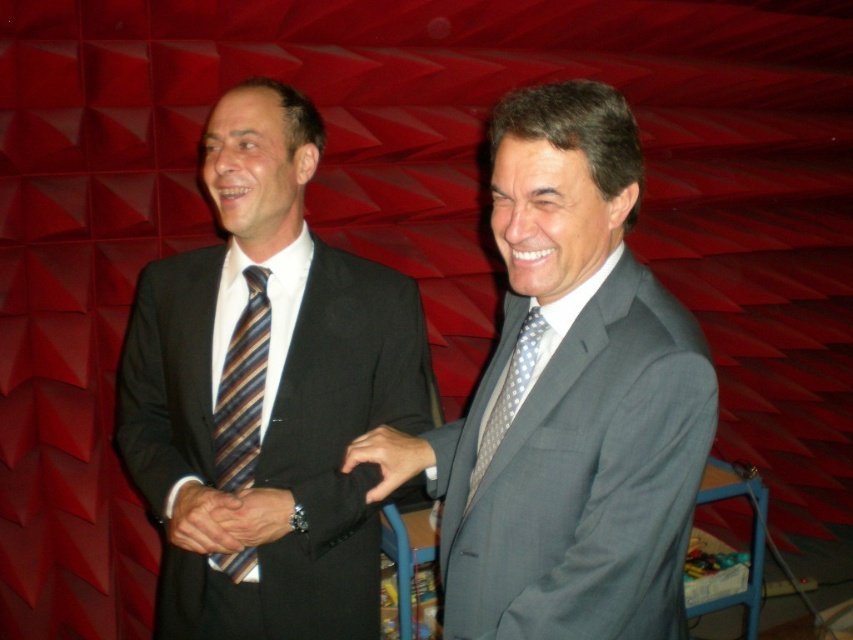
Question: Which is farther from the matte black suit at center?

Choices:
 (A) matte black suit at left
 (B) striped silk tie at left
 (C) gray textured suit at center

Answer: (C)

Question: Does matte black suit at left have a larger size compared to polka dot silk tie at center?

Choices:
 (A) yes
 (B) no

Answer: (A)

Question: Which of the following is the closest to the observer?

Choices:
 (A) (282, 508)
 (B) (541, 307)
 (C) (216, 493)

Answer: (B)

Question: Which point is closer to the camera?

Choices:
 (A) (517, 385)
 (B) (180, 518)
 (C) (692, 476)
 (D) (267, 529)

Answer: (C)

Question: Does matte black suit at left appear over smooth brown leather hand at center?

Choices:
 (A) yes
 (B) no

Answer: (A)

Question: Can you confirm if matte black wristwatch at center is positioned above matte black suit at center?

Choices:
 (A) yes
 (B) no

Answer: (B)